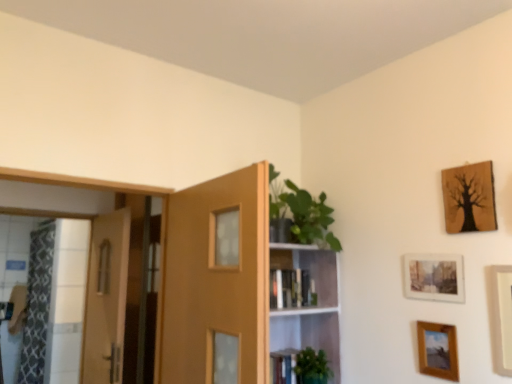
Question: From the image's perspective, is patterned fabric shower curtain at left on green matte plant at lower center?

Choices:
 (A) yes
 (B) no

Answer: (B)

Question: Is patterned fabric shower curtain at left further to the viewer compared to green matte plant at lower center?

Choices:
 (A) yes
 (B) no

Answer: (A)

Question: Does patterned fabric shower curtain at left have a lesser height compared to green matte plant at lower center?

Choices:
 (A) yes
 (B) no

Answer: (B)

Question: Does patterned fabric shower curtain at left have a smaller size compared to green matte plant at lower center?

Choices:
 (A) no
 (B) yes

Answer: (A)

Question: Considering the relative sizes of patterned fabric shower curtain at left and green matte plant at lower center in the image provided, is patterned fabric shower curtain at left bigger than green matte plant at lower center?

Choices:
 (A) yes
 (B) no

Answer: (A)

Question: Is patterned fabric shower curtain at left thinner than green matte plant at lower center?

Choices:
 (A) no
 (B) yes

Answer: (B)

Question: Is matte paper picture frame at upper right, which is the 3th picture frame from bottom to top, next to wooden door at left, marked as the 1th door in a back-to-front arrangement?

Choices:
 (A) no
 (B) yes

Answer: (A)

Question: Considering the relative positions of matte paper picture frame at upper right, placed as the second picture frame when sorted from top to bottom, and wooden door at left, placed as the 1th door when sorted from left to right, in the image provided, is matte paper picture frame at upper right, placed as the second picture frame when sorted from top to bottom, to the right of wooden door at left, placed as the 1th door when sorted from left to right, from the viewer's perspective?

Choices:
 (A) no
 (B) yes

Answer: (B)

Question: From the image's perspective, is matte paper picture frame at upper right, which is the 3th picture frame from bottom to top, on wooden door at left, marked as the 1th door in a back-to-front arrangement?

Choices:
 (A) yes
 (B) no

Answer: (A)

Question: Can you confirm if matte paper picture frame at upper right, placed as the second picture frame when sorted from top to bottom, is shorter than wooden door at left, which ranks as the 2th door in right-to-left order?

Choices:
 (A) no
 (B) yes

Answer: (B)

Question: Can you confirm if matte paper picture frame at upper right, which is the 3th picture frame from bottom to top, is taller than wooden door at left, marked as the 1th door in a back-to-front arrangement?

Choices:
 (A) no
 (B) yes

Answer: (A)

Question: Is matte paper picture frame at upper right, placed as the second picture frame when sorted from top to bottom, oriented towards wooden door at left, which ranks as the 2th door in right-to-left order?

Choices:
 (A) no
 (B) yes

Answer: (A)

Question: Is green glossy plant at upper center closer to camera compared to green matte plant at lower center?

Choices:
 (A) no
 (B) yes

Answer: (B)